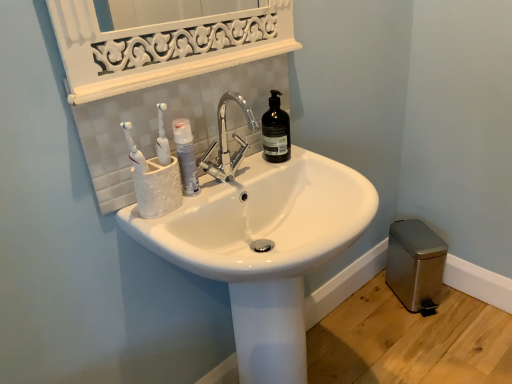
Locate an element on the screen. The image size is (512, 384). free space to the right of white glossy mouthwash at center is located at coordinates (237, 175).